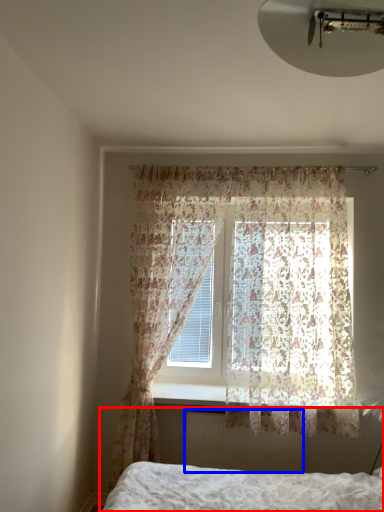
Question: Which point is closer to the camera, bed (highlighted by a red box) or radiator (highlighted by a blue box)?

Choices:
 (A) bed
 (B) radiator

Answer: (A)